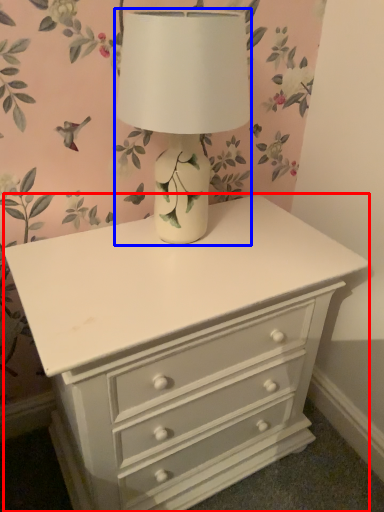
Question: Which object is closer to the camera taking this photo, chest of drawers (highlighted by a red box) or table lamp (highlighted by a blue box)?

Choices:
 (A) chest of drawers
 (B) table lamp

Answer: (B)